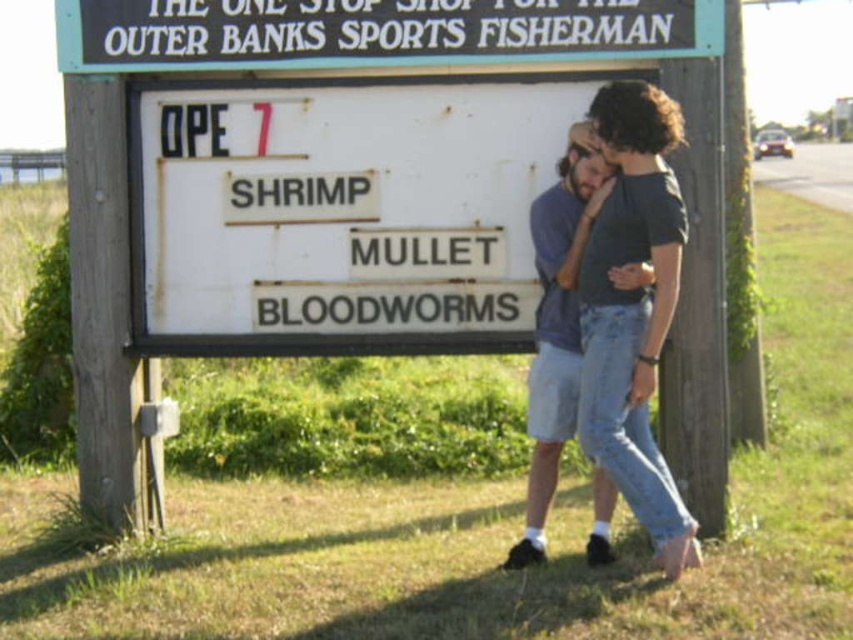
Who is more distant from viewer, (323,97) or (585,344)?

Point (323,97)

Between point (241, 305) and point (585, 438), which one is positioned in front?

Point (585, 438)

The image size is (853, 640). Identify the location of white matte signboard at center. (341, 211).

Between black plastic sign at upper center and denim shorts at center, which one has more height?

Standing taller between the two is denim shorts at center.

Who is positioned more to the left, black plastic sign at upper center or denim shorts at center?

From the viewer's perspective, black plastic sign at upper center appears more on the left side.

Where is `black plastic sign at upper center`? The height and width of the screenshot is (640, 853). black plastic sign at upper center is located at coordinates click(x=374, y=33).

Does white matte signboard at center have a lesser width compared to black plastic sign at upper center?

Correct, white matte signboard at center's width is less than black plastic sign at upper center's.

Looking at this image, can you confirm if white matte signboard at center is smaller than black plastic sign at upper center?

No, white matte signboard at center is not smaller than black plastic sign at upper center.

Find the location of `white matte signboard at center`. white matte signboard at center is located at coordinates (341, 211).